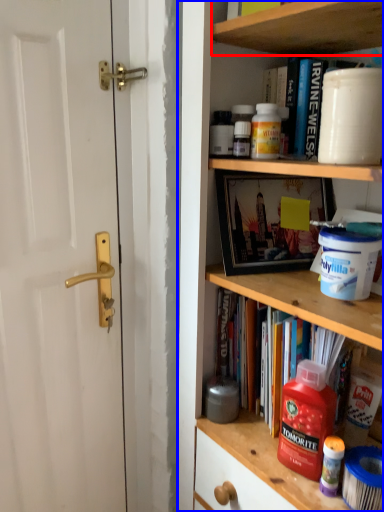
Question: Among these objects, which one is farthest to the camera, cabinet (highlighted by a red box) or shelf (highlighted by a blue box)?

Choices:
 (A) cabinet
 (B) shelf

Answer: (A)